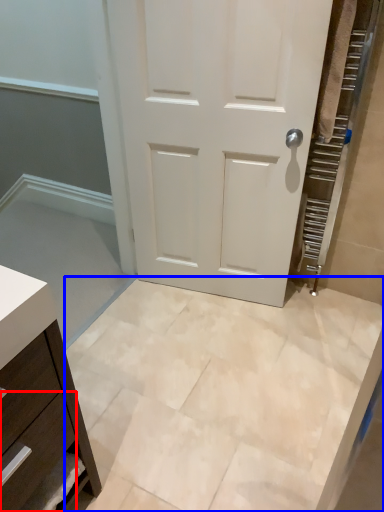
Question: Which point is further to the camera, drawer (highlighted by a red box) or ceramic tile (highlighted by a blue box)?

Choices:
 (A) drawer
 (B) ceramic tile

Answer: (B)